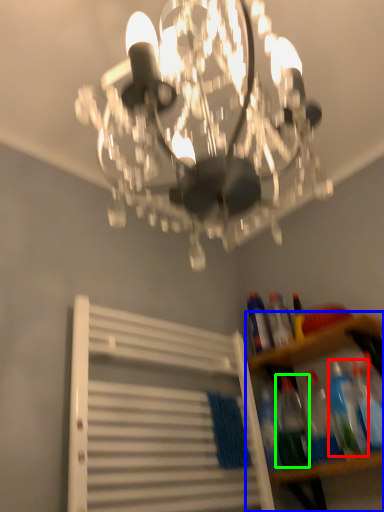
Question: Which is nearer to the bottle (highlighted by a red box)? shelf (highlighted by a blue box) or bottle (highlighted by a green box).

Choices:
 (A) shelf
 (B) bottle

Answer: (A)